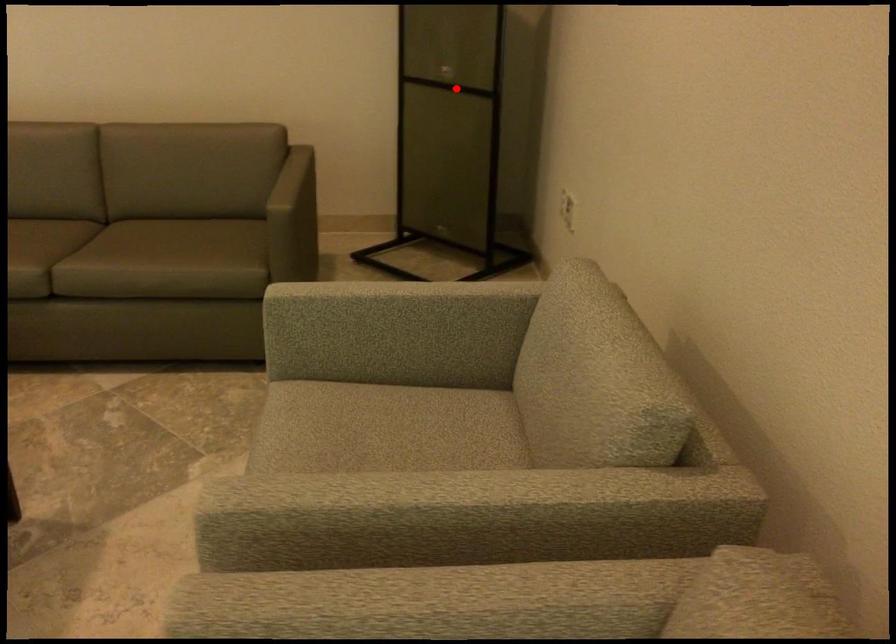
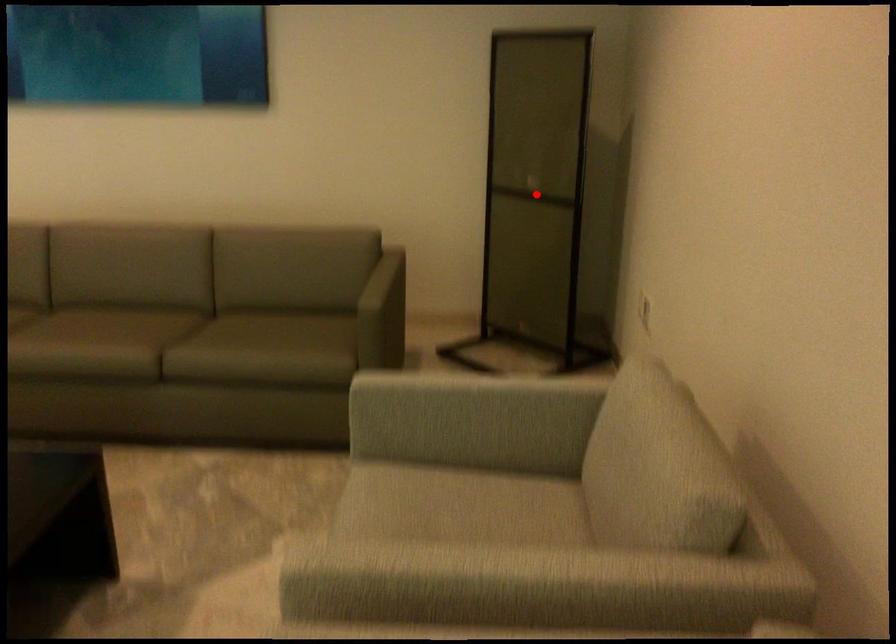
I am providing you with two images of the same scene from different viewpoints. A red point is marked on the first image and another point is marked on the second image. Do the highlighted points in image1 and image2 indicate the same real-world spot?

Yes